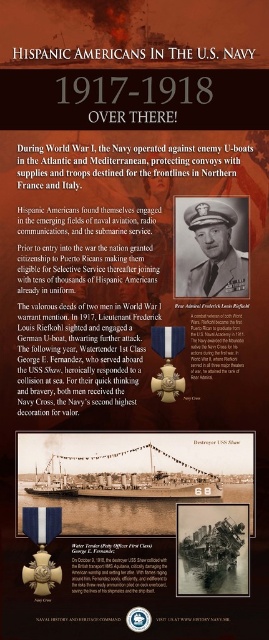
Based on the scene described, which object is positioned in the background? Please choose between the matte black uniform at center and the wooden ship at lower left.

The wooden ship at lower left is positioned behind the matte black uniform at center, so it is in the background.